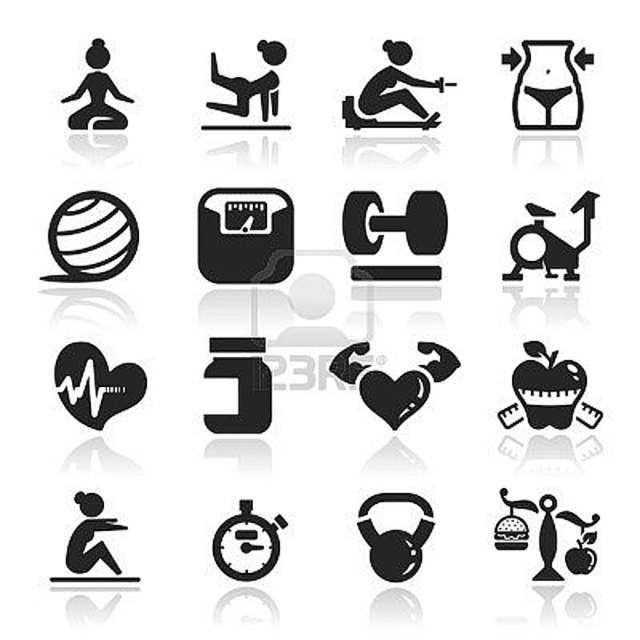
Is point (394, 61) farther from viewer compared to point (531, 214)?

No, it is not.

Find the location of a particular element. black matte rowing machine at center is located at coordinates (392, 93).

Locate an element on the screen. black matte rowing machine at center is located at coordinates (392, 93).

Who is more forward, (593, 56) or (116, 406)?

Point (593, 56)

Does transparent plastic waist at upper right have a lesser height compared to black heart at center?

In fact, transparent plastic waist at upper right may be taller than black heart at center.

Locate an element on the screen. This screenshot has width=640, height=640. transparent plastic waist at upper right is located at coordinates (547, 83).

Which is in front, point (106, 81) or point (264, 122)?

Point (106, 81)

Which is more to the right, black matte figure at upper left or black matte figure at center?

black matte figure at center

I want to click on black matte figure at upper left, so click(97, 93).